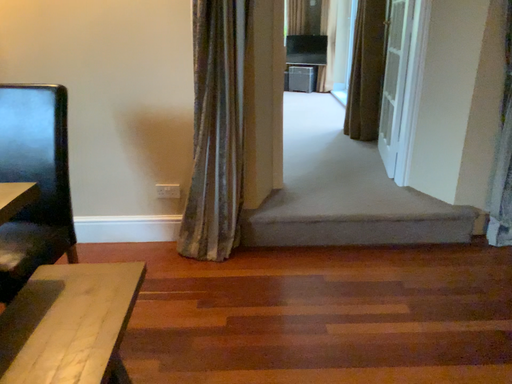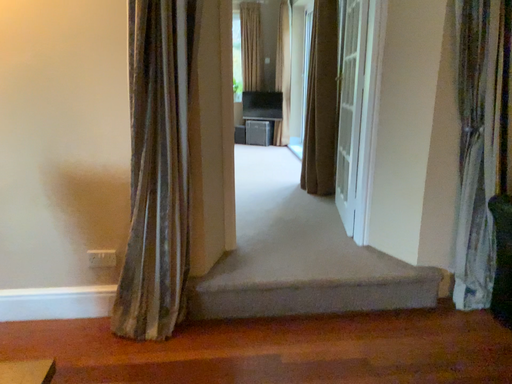
Question: How did the camera likely rotate when shooting the video?

Choices:
 (A) rotated downward
 (B) rotated upward

Answer: (B)